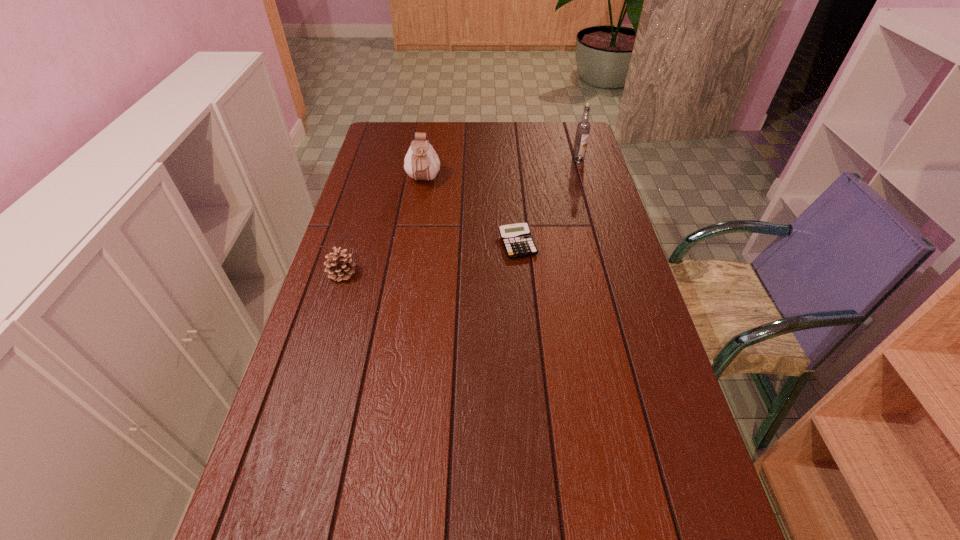
The width and height of the screenshot is (960, 540). Find the location of `vacant region that satisfies the following two spatial constraints: 1. on the front-facing side of the calculator; 2. on the left side of the pouch`. vacant region that satisfies the following two spatial constraints: 1. on the front-facing side of the calculator; 2. on the left side of the pouch is located at coordinates coord(414,244).